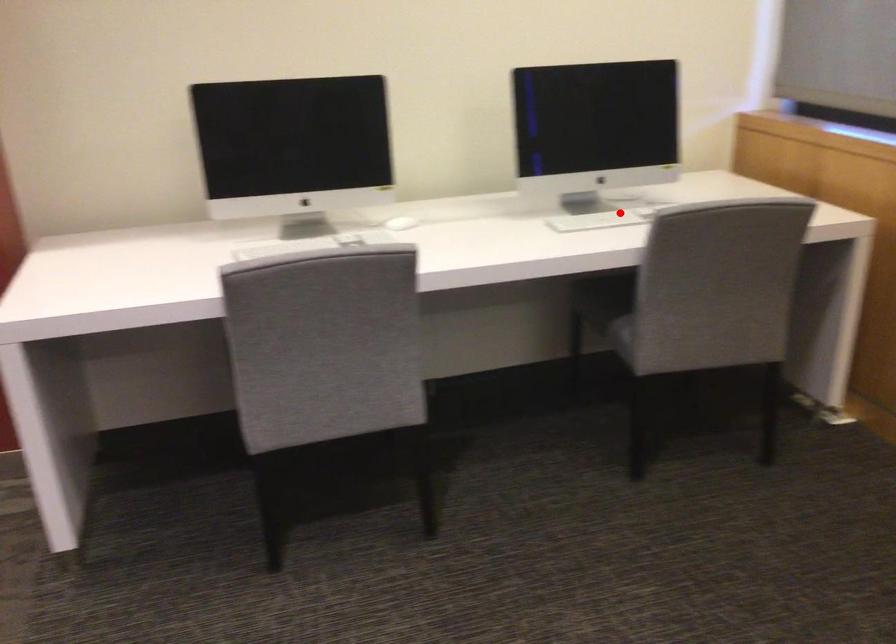
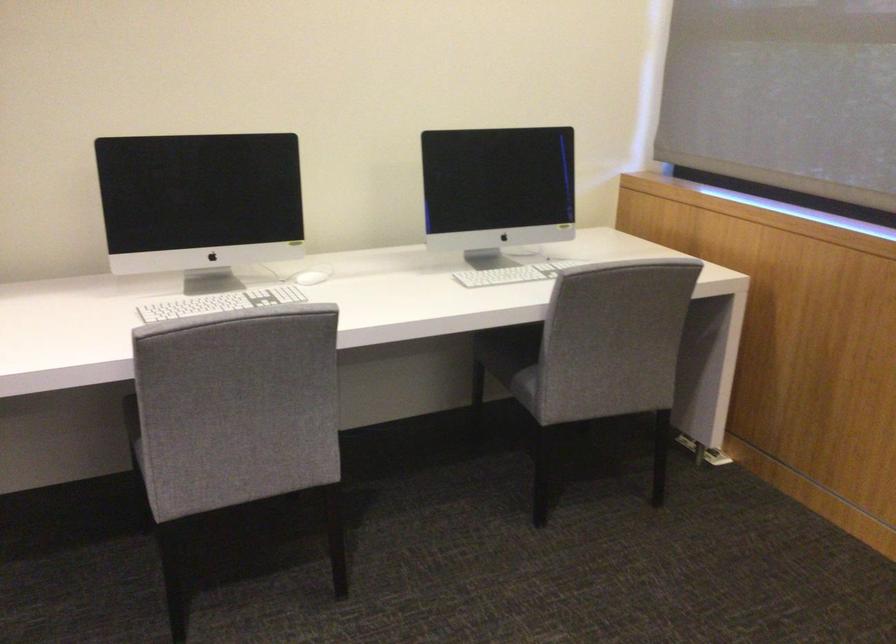
Find the pixel in the second image that matches the highlighted location in the first image.

(519, 270)